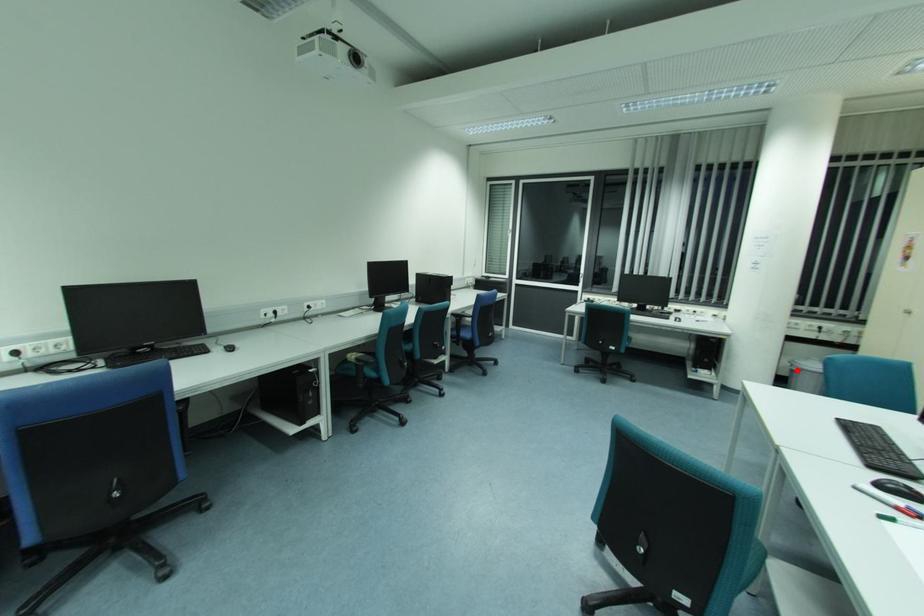
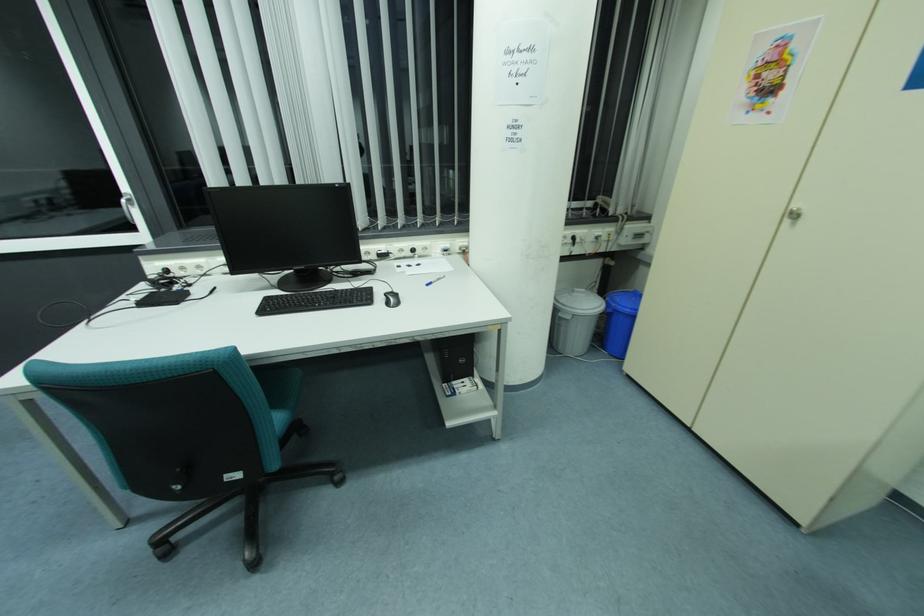
In the second image, find the point that corresponds to the highlighted location in the first image.

(568, 318)